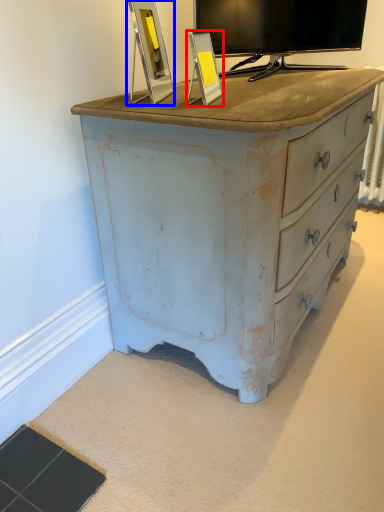
Question: Among these objects, which one is nearest to the camera, picture frame (highlighted by a red box) or picture frame (highlighted by a blue box)?

Choices:
 (A) picture frame
 (B) picture frame

Answer: (B)